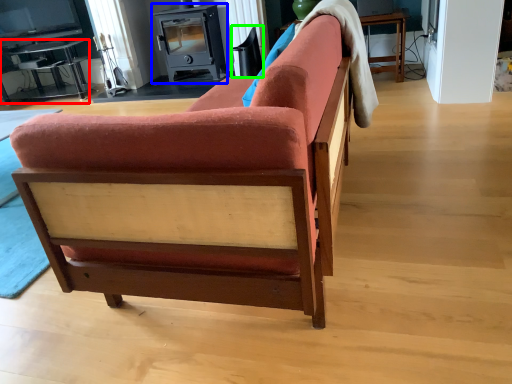
Question: Which object is the farthest from table (highlighted by a red box)? Choose among these: appliance (highlighted by a blue box) or swivel chair (highlighted by a green box).

Choices:
 (A) appliance
 (B) swivel chair

Answer: (B)